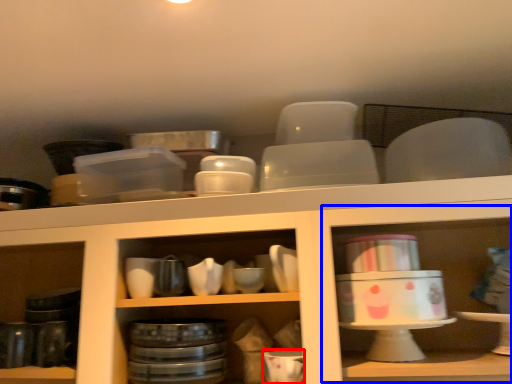
Question: Which object appears farthest to the camera in this image, tableware (highlighted by a red box) or shelf (highlighted by a blue box)?

Choices:
 (A) tableware
 (B) shelf

Answer: (A)